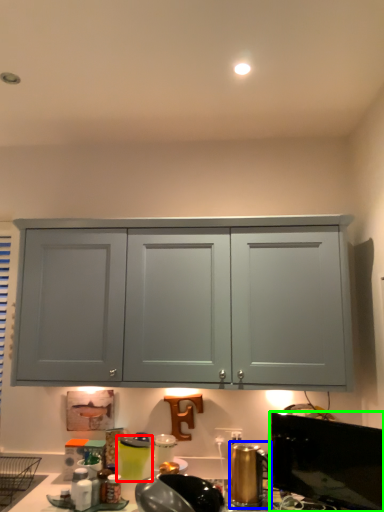
Question: Which object is positioned farthest from appliance (highlighted by a red box)? Select from appliance (highlighted by a blue box) and window screen (highlighted by a green box).

Choices:
 (A) appliance
 (B) window screen

Answer: (B)